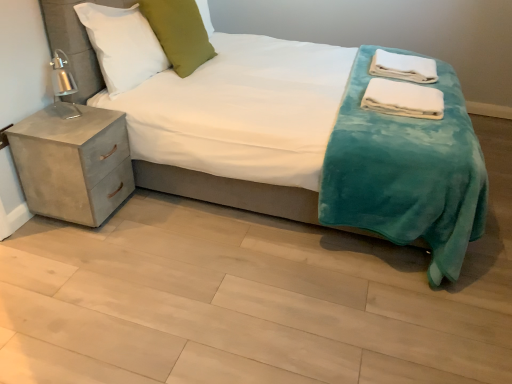
At what (x,y) coordinates should I click in order to perform the action: click on green velvet pillow at upper center, which appears as the second pillow when viewed from the left. Please return your answer as a coordinate pair (x, y). This screenshot has width=512, height=384. Looking at the image, I should click on (179, 33).

This screenshot has width=512, height=384. Describe the element at coordinates (403, 67) in the screenshot. I see `white soft towels at upper right, the second material from the bottom` at that location.

The image size is (512, 384). What do you see at coordinates (122, 45) in the screenshot?
I see `white soft pillow at upper left, the 2th pillow in the right-to-left sequence` at bounding box center [122, 45].

Describe the element at coordinates (403, 99) in the screenshot. I see `white soft towels at right, positioned as the 1th material in front-to-back order` at that location.

Identify the location of concrete nightstand at left. The width and height of the screenshot is (512, 384). (73, 164).

Consider the image. Is white soft towels at right, the 1th material from the bottom, placed right next to green velvet pillow at upper center, which appears as the second pillow when viewed from the left?

No, white soft towels at right, the 1th material from the bottom, is not in contact with green velvet pillow at upper center, which appears as the second pillow when viewed from the left.

From a real-world perspective, count 2nd materials downward from the green velvet pillow at upper center, the first pillow when ordered from right to left, and point to it. Please provide its 2D coordinates.

[(403, 99)]

Is white soft towels at right, the 1th material from the bottom, inside or outside of green velvet pillow at upper center, the first pillow when ordered from right to left?

white soft towels at right, the 1th material from the bottom, is located beyond the bounds of green velvet pillow at upper center, the first pillow when ordered from right to left.

Is concrete nightstand at left completely or partially outside of white soft towels at upper right, the second material from the bottom?

Indeed, concrete nightstand at left is completely outside white soft towels at upper right, the second material from the bottom.

Is concrete nightstand at left facing away from white soft towels at upper right, the second material from the bottom?

Answer: No, concrete nightstand at left's orientation is not away from white soft towels at upper right, the second material from the bottom.

Considering their positions, is concrete nightstand at left located in front of or behind white soft towels at upper right, the 1th material positioned from the back?

Visually, concrete nightstand at left is located in front of white soft towels at upper right, the 1th material positioned from the back.

Is green velvet pillow at upper center, the first pillow when ordered from right to left, taller or shorter than white soft pillow at upper left, the 2th pillow in the right-to-left sequence?

Considering their sizes, green velvet pillow at upper center, the first pillow when ordered from right to left, has more height than white soft pillow at upper left, the 2th pillow in the right-to-left sequence.

Which is more distant, (169, 27) or (105, 61)?

The point (169, 27) is farther.

Which object is further away from the camera taking this photo, green velvet pillow at upper center, the first pillow when ordered from right to left, or white soft pillow at upper left, the 1th pillow positioned from the left?

green velvet pillow at upper center, the first pillow when ordered from right to left.

From the image's perspective, is green velvet pillow at upper center, the first pillow when ordered from right to left, above white soft pillow at upper left, the 2th pillow in the right-to-left sequence?

Yes, from the image's perspective, green velvet pillow at upper center, the first pillow when ordered from right to left, is on top of white soft pillow at upper left, the 2th pillow in the right-to-left sequence.

From the image's perspective, is white soft pillow at upper left, the 2th pillow in the right-to-left sequence, below teal plush blanket at center?

No, from the image's perspective, white soft pillow at upper left, the 2th pillow in the right-to-left sequence, is not below teal plush blanket at center.

Is teal plush blanket at center completely or partially inside white soft pillow at upper left, the 2th pillow in the right-to-left sequence?

Actually, teal plush blanket at center is outside white soft pillow at upper left, the 2th pillow in the right-to-left sequence.

From a real-world perspective, which is physically above, white soft pillow at upper left, the 1th pillow positioned from the left, or teal plush blanket at center?

In real-world perspective, white soft pillow at upper left, the 1th pillow positioned from the left, is above.

From a real-world perspective, starting from the white soft towels at upper right, the second material from the bottom, which pillow is the 2nd one vertically above it? Please provide its 2D coordinates.

[(122, 45)]

Is white soft pillow at upper left, the 2th pillow in the right-to-left sequence, facing towards white soft towels at upper right, placed as the 2th material when sorted from front to back?

No, white soft pillow at upper left, the 2th pillow in the right-to-left sequence, is not facing towards white soft towels at upper right, placed as the 2th material when sorted from front to back.

From a real-world perspective, is white soft pillow at upper left, the 2th pillow in the right-to-left sequence, below white soft towels at upper right, the 1th material positioned from the back?

Incorrect, from a real-world perspective, white soft pillow at upper left, the 2th pillow in the right-to-left sequence, is higher than white soft towels at upper right, the 1th material positioned from the back.

Is white soft pillow at upper left, the 1th pillow positioned from the left, bigger than white soft towels at upper right, the first material in the top-to-bottom sequence?

Correct, white soft pillow at upper left, the 1th pillow positioned from the left, is larger in size than white soft towels at upper right, the first material in the top-to-bottom sequence.

Is the surface of white soft pillow at upper left, the 2th pillow in the right-to-left sequence, in direct contact with concrete nightstand at left?

They are not placed beside each other.

From the image's perspective, is white soft pillow at upper left, the 2th pillow in the right-to-left sequence, over concrete nightstand at left?

Yes, from the image's perspective, white soft pillow at upper left, the 2th pillow in the right-to-left sequence, is over concrete nightstand at left.

Which of these two, white soft pillow at upper left, the 2th pillow in the right-to-left sequence, or concrete nightstand at left, is thinner?

With smaller width is white soft pillow at upper left, the 2th pillow in the right-to-left sequence.

Is white soft pillow at upper left, the 2th pillow in the right-to-left sequence, taller or shorter than concrete nightstand at left?

Clearly, white soft pillow at upper left, the 2th pillow in the right-to-left sequence, is shorter compared to concrete nightstand at left.

Relative to white soft towels at upper right, the first material in the top-to-bottom sequence, is green velvet pillow at upper center, the first pillow when ordered from right to left, in front or behind?

Clearly, green velvet pillow at upper center, the first pillow when ordered from right to left, is in front of white soft towels at upper right, the first material in the top-to-bottom sequence.

How many degrees apart are the facing directions of green velvet pillow at upper center, which appears as the second pillow when viewed from the left, and white soft towels at upper right, the first material in the top-to-bottom sequence?

The angular difference between green velvet pillow at upper center, which appears as the second pillow when viewed from the left, and white soft towels at upper right, the first material in the top-to-bottom sequence, is 3.41 degrees.

Looking at the image, does green velvet pillow at upper center, the first pillow when ordered from right to left, seem bigger or smaller compared to white soft towels at upper right, placed as the 2th material when sorted from front to back?

In the image, green velvet pillow at upper center, the first pillow when ordered from right to left, appears to be larger than white soft towels at upper right, placed as the 2th material when sorted from front to back.

Where is `the 2nd material below the green velvet pillow at upper center, the first pillow when ordered from right to left (from a real-world perspective)`? the 2nd material below the green velvet pillow at upper center, the first pillow when ordered from right to left (from a real-world perspective) is located at coordinates click(x=403, y=99).

Locate an element on the screen. This screenshot has width=512, height=384. nightstand below the white soft towels at upper right, the 1th material positioned from the back (from the image's perspective) is located at coordinates (73, 164).

When comparing their distances from white soft towels at right, the 2th material in the back-to-front sequence, does white soft pillow at upper left, the 2th pillow in the right-to-left sequence, or concrete nightstand at left seem closer?

white soft pillow at upper left, the 2th pillow in the right-to-left sequence.

From the image, which object appears to be nearer to white soft towels at upper right, the first material in the top-to-bottom sequence, white soft towels at right, arranged as the second material when viewed from the top, or concrete nightstand at left?

white soft towels at right, arranged as the second material when viewed from the top, lies closer to white soft towels at upper right, the first material in the top-to-bottom sequence, than the other object.

Based on their spatial positions, is white soft towels at upper right, the second material from the bottom, or teal plush blanket at center closer to concrete nightstand at left?

teal plush blanket at center lies closer to concrete nightstand at left than the other object.

Considering their positions, is teal plush blanket at center positioned closer to white soft towels at upper right, placed as the 2th material when sorted from front to back, than white soft towels at right, arranged as the second material when viewed from the top?

Based on the image, white soft towels at right, arranged as the second material when viewed from the top, appears to be nearer to white soft towels at upper right, placed as the 2th material when sorted from front to back.

Considering their positions, is teal plush blanket at center positioned further to concrete nightstand at left than green velvet pillow at upper center, which appears as the second pillow when viewed from the left?

Among the two, teal plush blanket at center is located further to concrete nightstand at left.

From the image, which object appears to be nearer to teal plush blanket at center, white soft towels at right, the 1th material from the bottom, or green velvet pillow at upper center, the first pillow when ordered from right to left?

Among the two, white soft towels at right, the 1th material from the bottom, is located nearer to teal plush blanket at center.

Looking at the image, which one is located further to white soft pillow at upper left, the 2th pillow in the right-to-left sequence, green velvet pillow at upper center, the first pillow when ordered from right to left, or concrete nightstand at left?

The object further to white soft pillow at upper left, the 2th pillow in the right-to-left sequence, is concrete nightstand at left.

From the image, which object appears to be nearer to white soft pillow at upper left, the 1th pillow positioned from the left, concrete nightstand at left or white soft towels at upper right, the 1th material positioned from the back?

The object closer to white soft pillow at upper left, the 1th pillow positioned from the left, is concrete nightstand at left.

What are the coordinates of `pillow located between white soft pillow at upper left, the 1th pillow positioned from the left, and white soft towels at right, the 2th material in the back-to-front sequence, in the left-right direction` in the screenshot? It's located at (179, 33).

Locate an element on the screen. The height and width of the screenshot is (384, 512). bed situated between green velvet pillow at upper center, the first pillow when ordered from right to left, and white soft towels at upper right, placed as the 2th material when sorted from front to back, from left to right is located at coordinates (407, 172).

Locate an element on the screen. pillow located between white soft pillow at upper left, the 1th pillow positioned from the left, and white soft towels at upper right, the 1th material positioned from the back, in the left-right direction is located at coordinates (179, 33).

What are the coordinates of `bed between concrete nightstand at left and white soft towels at upper right, placed as the 2th material when sorted from front to back, from left to right` in the screenshot? It's located at (407, 172).